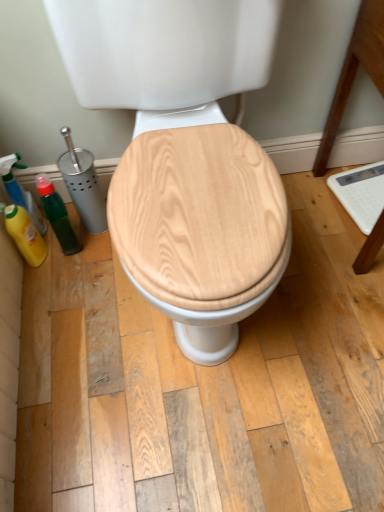
Image resolution: width=384 pixels, height=512 pixels. What are the coordinates of `unoccupied region to the right of yellow matte bottle at left, the 1th cleaning product positioned from the bottom` in the screenshot? It's located at (91, 266).